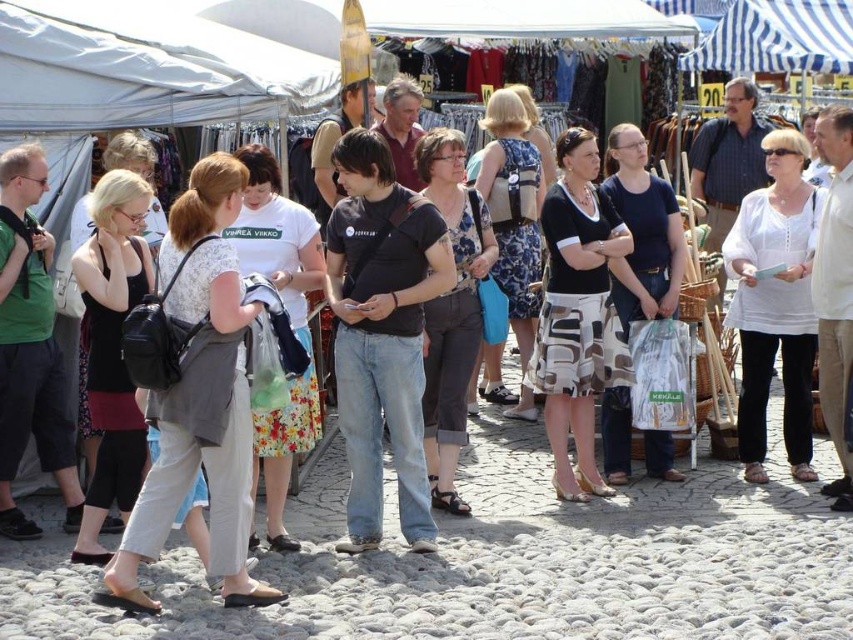
Question: Estimate the real-world distances between objects in this image. Which object is closer to the dark blue t-shirt at center?

Choices:
 (A) white cotton blouse at center
 (B) patterned fabric skirt at center

Answer: (B)

Question: Which object is closer to the camera taking this photo?

Choices:
 (A) white cotton blouse at center
 (B) patterned fabric skirt at center
 (C) dark blue t-shirt at center

Answer: (C)

Question: Does dark blue t-shirt at center appear on the right side of patterned fabric skirt at center?

Choices:
 (A) no
 (B) yes

Answer: (A)

Question: Is white cotton blouse at center to the right of patterned fabric skirt at center from the viewer's perspective?

Choices:
 (A) no
 (B) yes

Answer: (B)

Question: Is dark blue t-shirt at center positioned behind white cotton blouse at center?

Choices:
 (A) yes
 (B) no

Answer: (B)

Question: Based on their relative distances, which object is farther from the dark blue t-shirt at center?

Choices:
 (A) patterned fabric skirt at center
 (B) white cotton blouse at center

Answer: (B)